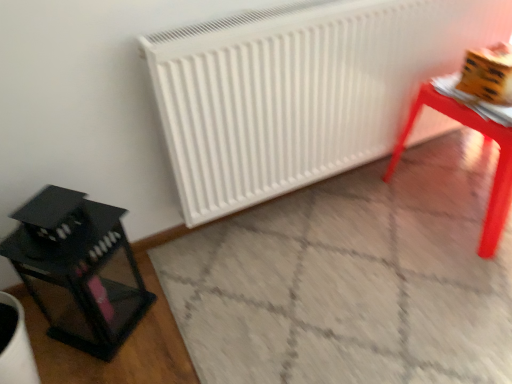
Question: Does smooth glossy table at right lie behind black glass lantern at left?

Choices:
 (A) no
 (B) yes

Answer: (B)

Question: Is smooth glossy table at right at the right side of black glass lantern at left?

Choices:
 (A) no
 (B) yes

Answer: (B)

Question: From the image's perspective, would you say smooth glossy table at right is shown under black glass lantern at left?

Choices:
 (A) no
 (B) yes

Answer: (A)

Question: Does smooth glossy table at right have a greater width compared to black glass lantern at left?

Choices:
 (A) no
 (B) yes

Answer: (B)

Question: Can you confirm if smooth glossy table at right is shorter than black glass lantern at left?

Choices:
 (A) no
 (B) yes

Answer: (B)

Question: In terms of width, does black glass lantern at left look wider or thinner when compared to smooth glossy table at right?

Choices:
 (A) thin
 (B) wide

Answer: (A)

Question: Considering the positions of black glass lantern at left and smooth glossy table at right in the image, is black glass lantern at left bigger or smaller than smooth glossy table at right?

Choices:
 (A) small
 (B) big

Answer: (A)

Question: Is black glass lantern at left in front of or behind smooth glossy table at right in the image?

Choices:
 (A) front
 (B) behind

Answer: (A)

Question: From the image's perspective, relative to smooth glossy table at right, is black glass lantern at left above or below?

Choices:
 (A) below
 (B) above

Answer: (A)

Question: Is smooth glossy table at right wider or thinner than black glass lantern at left?

Choices:
 (A) wide
 (B) thin

Answer: (A)

Question: Considering their positions, is smooth glossy table at right located in front of or behind black glass lantern at left?

Choices:
 (A) front
 (B) behind

Answer: (B)

Question: Would you say smooth glossy table at right is inside or outside black glass lantern at left?

Choices:
 (A) inside
 (B) outside

Answer: (B)

Question: From the image's perspective, is smooth glossy table at right located above or below black glass lantern at left?

Choices:
 (A) above
 (B) below

Answer: (A)

Question: In the image, is smooth glossy table at right positioned in front of or behind white matte radiator at center?

Choices:
 (A) front
 (B) behind

Answer: (B)

Question: From a real-world perspective, is smooth glossy table at right positioned above or below white matte radiator at center?

Choices:
 (A) above
 (B) below

Answer: (B)